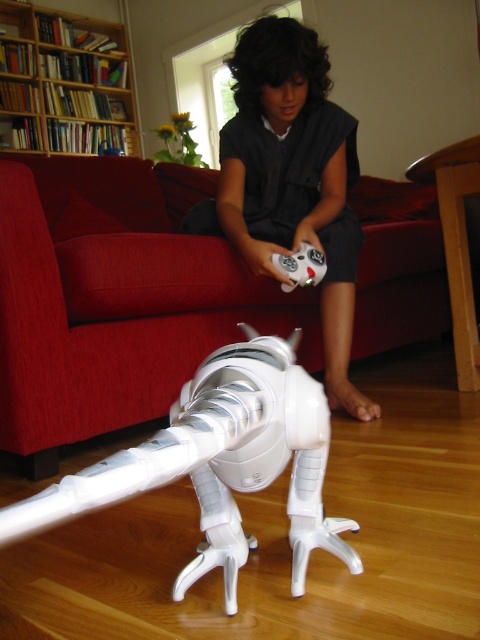
Consider the image. You are trying to decide whether to place the white plastic toy at lower center on top of the white matte game controller at center. Based on their sizes, do you think the toy will fit without falling off?

The white plastic toy at lower center might be wider than the white matte game controller at center, so it may not fit securely and could fall off.

You are a delivery robot trying to deliver a package to the red fabric couch at lower center. The package is too large to place on the white matte game controller at center. Can you place it on the couch instead?

The red fabric couch at lower center is taller than the white matte game controller at center, so yes, the package can be placed on the couch since it is taller and likely has more space.